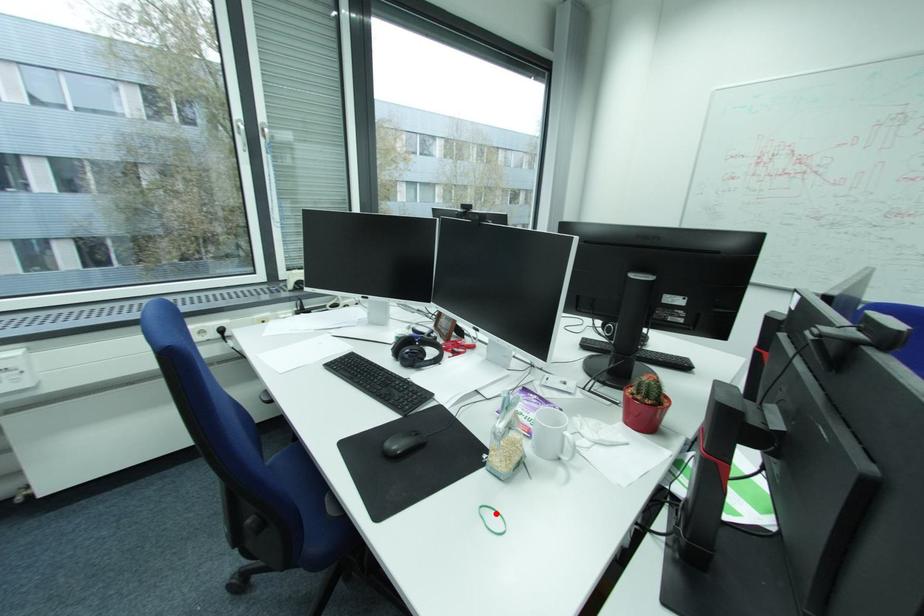
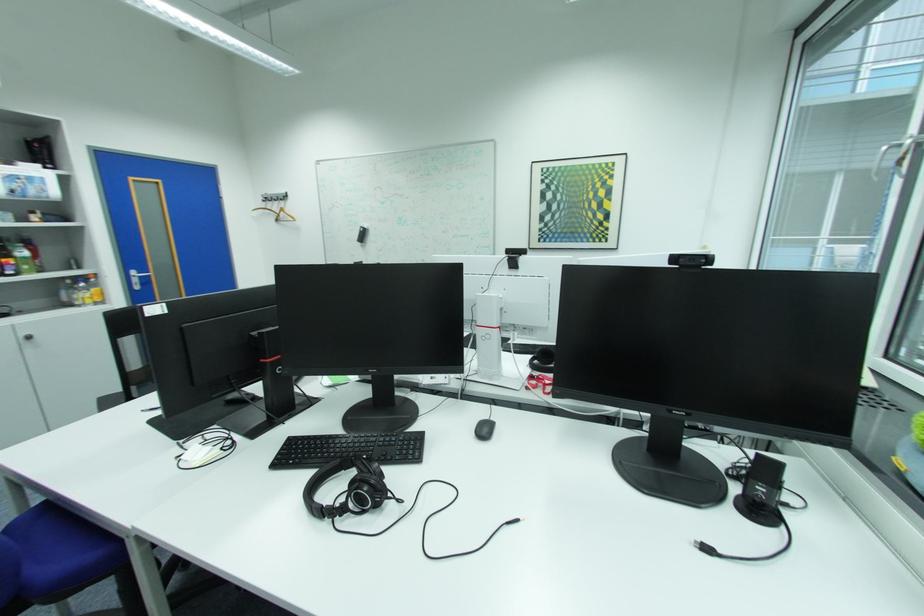
Question: I am providing you with two images of the same scene from different viewpoints. A red point is marked on the first image. At the location where the point appears in image 1, is it still visible in image 2?

Choices:
 (A) Yes
 (B) No

Answer: (B)